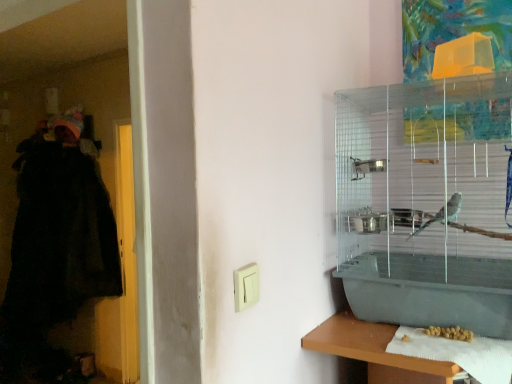
Identify the location of vacant space that is to the left of yellow matte seeds at lower right. The image size is (512, 384). (412, 342).